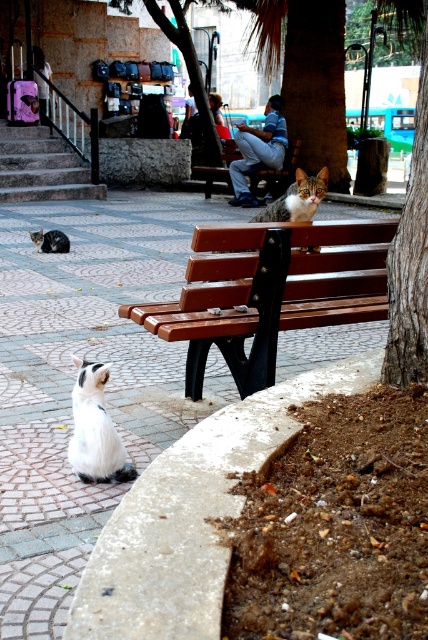
Question: Is white fluffy cat at lower left below brown wooden bench at center?

Choices:
 (A) no
 (B) yes

Answer: (B)

Question: Is brown wooden bench at center thinner than gray fur cat at center?

Choices:
 (A) no
 (B) yes

Answer: (A)

Question: Which point appears closest to the camera in this image?

Choices:
 (A) (62, 243)
 (B) (421, 316)
 (C) (76, 467)
 (D) (259, 387)

Answer: (B)

Question: Which is farther from the gray fur cat at center?

Choices:
 (A) brown wooden bench at center
 (B) wooden bench at center
 (C) white fluffy cat at lower left

Answer: (C)

Question: Which of the following is the closest to the observer?

Choices:
 (A) green textured tree at center
 (B) tabby fur cat at center

Answer: (A)

Question: In this image, where is wooden bench at center located relative to white fluffy cat at lower left?

Choices:
 (A) right
 (B) left

Answer: (A)